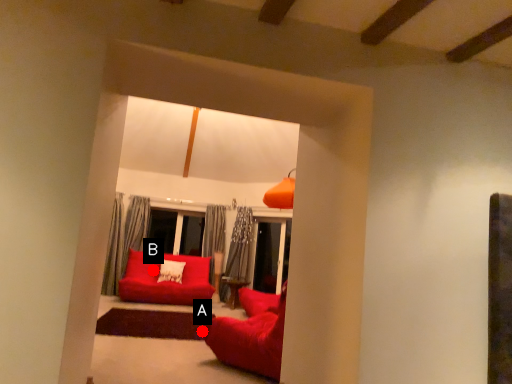
Question: Two points are circled on the image, labeled by A and B beside each circle. Which point is farther to the camera?

Choices:
 (A) A is further
 (B) B is further

Answer: (B)